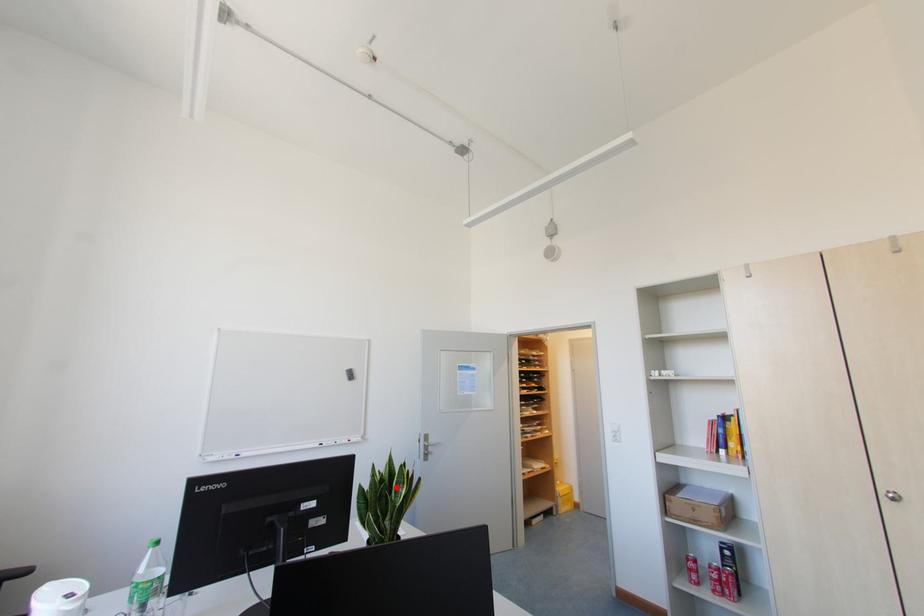
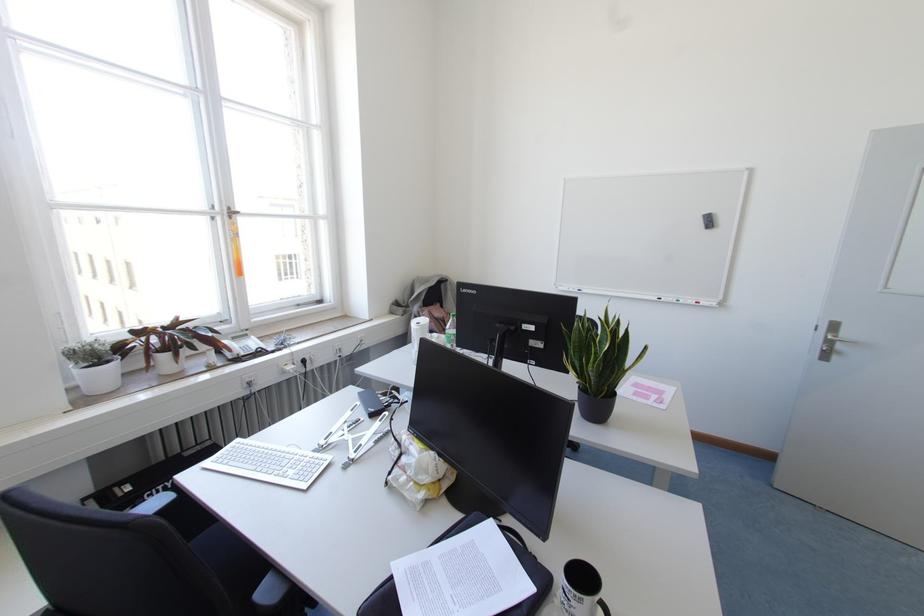
Where in the second image is the point corresponding to the highlighted location from the first image?

(599, 342)